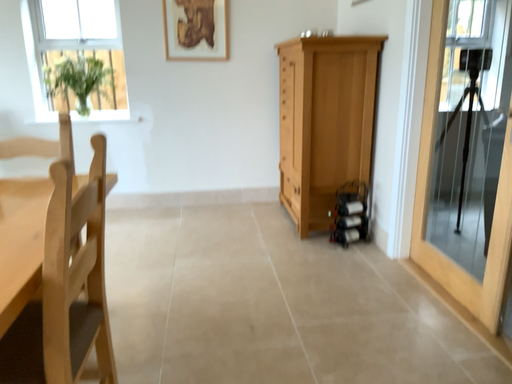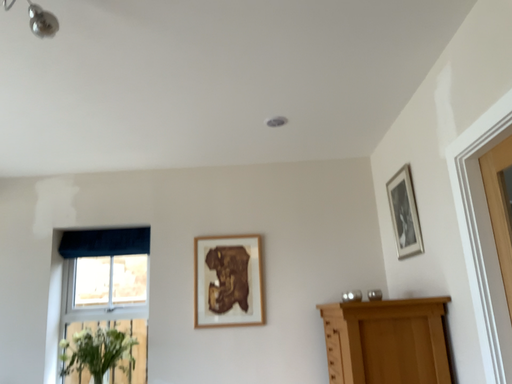
Question: Which way did the camera rotate in the video?

Choices:
 (A) rotated downward
 (B) rotated upward

Answer: (B)